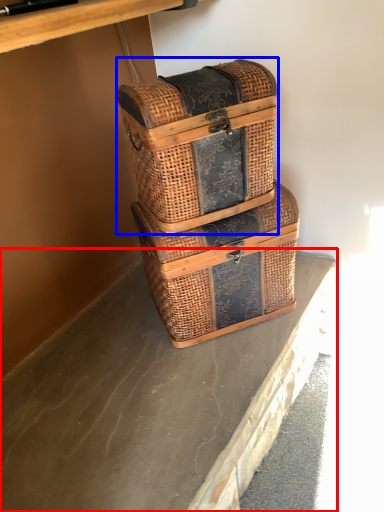
Question: Which object appears farthest to the camera in this image, concrete (highlighted by a red box) or picnic basket (highlighted by a blue box)?

Choices:
 (A) concrete
 (B) picnic basket

Answer: (B)